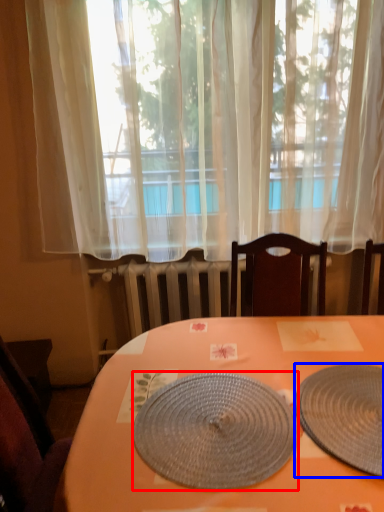
Question: Among these objects, which one is nearest to the camera, plate (highlighted by a red box) or plate (highlighted by a blue box)?

Choices:
 (A) plate
 (B) plate

Answer: (B)